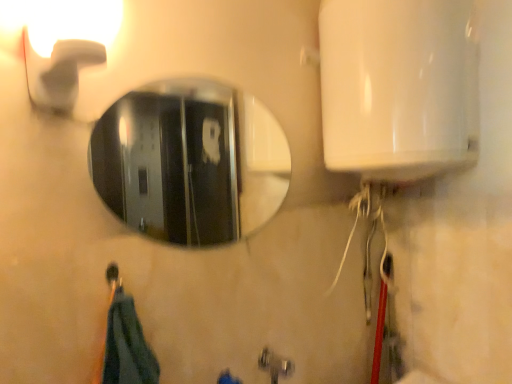
Question: Is shiny metallic mirror at center facing away from matte white faucet at upper left?

Choices:
 (A) yes
 (B) no

Answer: (B)

Question: From a real-world perspective, is shiny metallic mirror at center positioned over matte white faucet at upper left based on gravity?

Choices:
 (A) no
 (B) yes

Answer: (A)

Question: Can you confirm if shiny metallic mirror at center is taller than matte white faucet at upper left?

Choices:
 (A) no
 (B) yes

Answer: (B)

Question: Can you confirm if shiny metallic mirror at center is positioned to the right of matte white faucet at upper left?

Choices:
 (A) yes
 (B) no

Answer: (A)

Question: From the image's perspective, is shiny metallic mirror at center below matte white faucet at upper left?

Choices:
 (A) yes
 (B) no

Answer: (A)

Question: Looking at their shapes, would you say metallic silver faucet at lower center is wider or thinner than shiny metallic mirror at center?

Choices:
 (A) thin
 (B) wide

Answer: (B)

Question: Considering the positions of metallic silver faucet at lower center and shiny metallic mirror at center in the image, is metallic silver faucet at lower center taller or shorter than shiny metallic mirror at center?

Choices:
 (A) short
 (B) tall

Answer: (A)

Question: From a real-world perspective, is metallic silver faucet at lower center positioned above or below shiny metallic mirror at center?

Choices:
 (A) below
 (B) above

Answer: (A)

Question: Visually, is metallic silver faucet at lower center positioned to the left or to the right of shiny metallic mirror at center?

Choices:
 (A) right
 (B) left

Answer: (A)

Question: Based on their positions, is matte white faucet at upper left located to the left or right of shiny metallic mirror at center?

Choices:
 (A) right
 (B) left

Answer: (B)

Question: From a real-world perspective, is matte white faucet at upper left positioned above or below shiny metallic mirror at center?

Choices:
 (A) above
 (B) below

Answer: (A)

Question: Is matte white faucet at upper left inside the boundaries of shiny metallic mirror at center, or outside?

Choices:
 (A) inside
 (B) outside

Answer: (B)

Question: In terms of height, does matte white faucet at upper left look taller or shorter compared to shiny metallic mirror at center?

Choices:
 (A) short
 (B) tall

Answer: (A)

Question: Considering their positions, is matte white faucet at upper left located in front of or behind metallic silver faucet at lower center?

Choices:
 (A) behind
 (B) front

Answer: (B)

Question: Considering the relative positions of matte white faucet at upper left and metallic silver faucet at lower center in the image provided, is matte white faucet at upper left to the left or to the right of metallic silver faucet at lower center?

Choices:
 (A) left
 (B) right

Answer: (A)